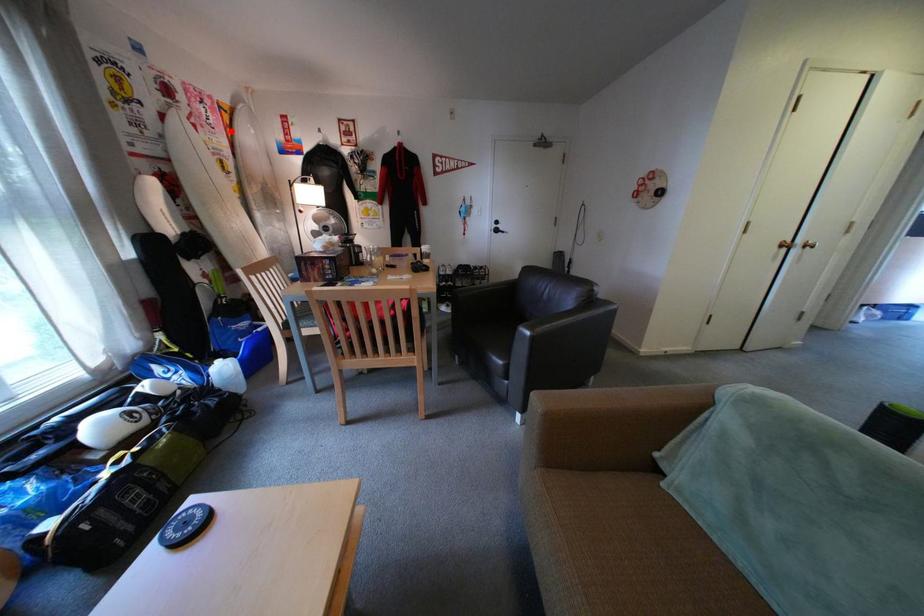
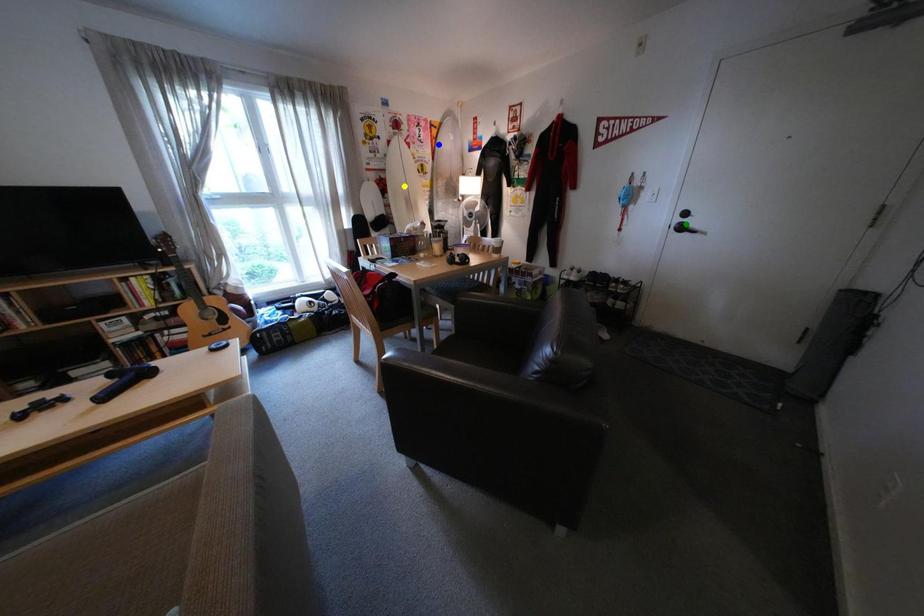
Question: I am providing you with two images of the same scene from different viewpoints. A red point is marked on the first image. You are given multiple points on the second image. Can you choose the point in image 2 that corresponds to the point in image 1?

Choices:
 (A) yellow point
 (B) green point
 (C) blue point

Answer: (C)